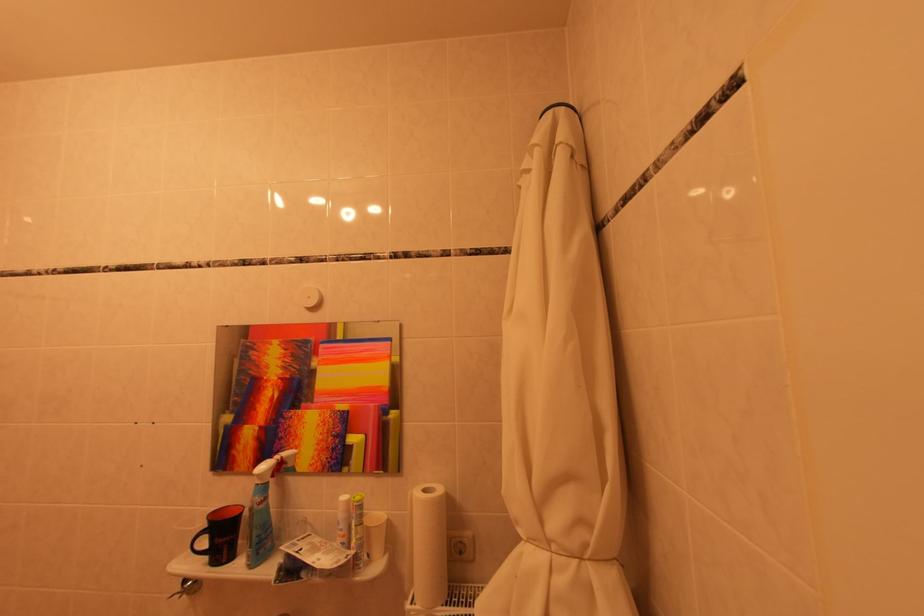
I want to click on white paper towel roll, so click(429, 546).